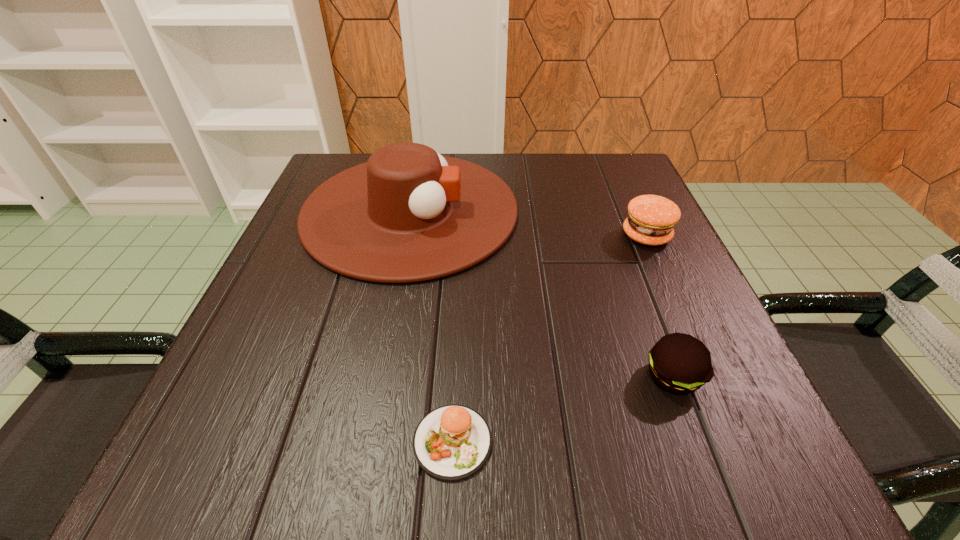
Where is `object that is at the near edge`? Image resolution: width=960 pixels, height=540 pixels. object that is at the near edge is located at coordinates (452, 442).

Identify the location of object present at the left edge. This screenshot has width=960, height=540. (409, 214).

I want to click on object that is at the far left corner, so click(x=409, y=214).

Identify the location of vacant region at the far edge of the desktop. (527, 156).

Image resolution: width=960 pixels, height=540 pixels. What are the coordinates of `vacant region at the near edge of the desktop` in the screenshot? It's located at (637, 469).

Where is `free space at the left edge of the desktop`? This screenshot has height=540, width=960. free space at the left edge of the desktop is located at coordinates (293, 410).

This screenshot has height=540, width=960. In order to click on vacant space at the right edge of the desktop in this screenshot , I will do `click(611, 237)`.

Locate an element on the screen. This screenshot has height=540, width=960. free space at the far left corner is located at coordinates (364, 163).

Locate an element on the screen. This screenshot has height=540, width=960. vacant space at the far right corner of the desktop is located at coordinates (647, 190).

Locate an element on the screen. free spot between the second nearest object and the farthest patty is located at coordinates click(660, 306).